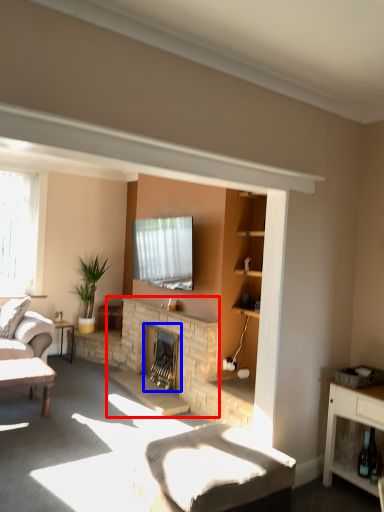
Question: Which of the following is the closest to the observer, fireplace (highlighted by a red box) or fireplace (highlighted by a blue box)?

Choices:
 (A) fireplace
 (B) fireplace

Answer: (A)